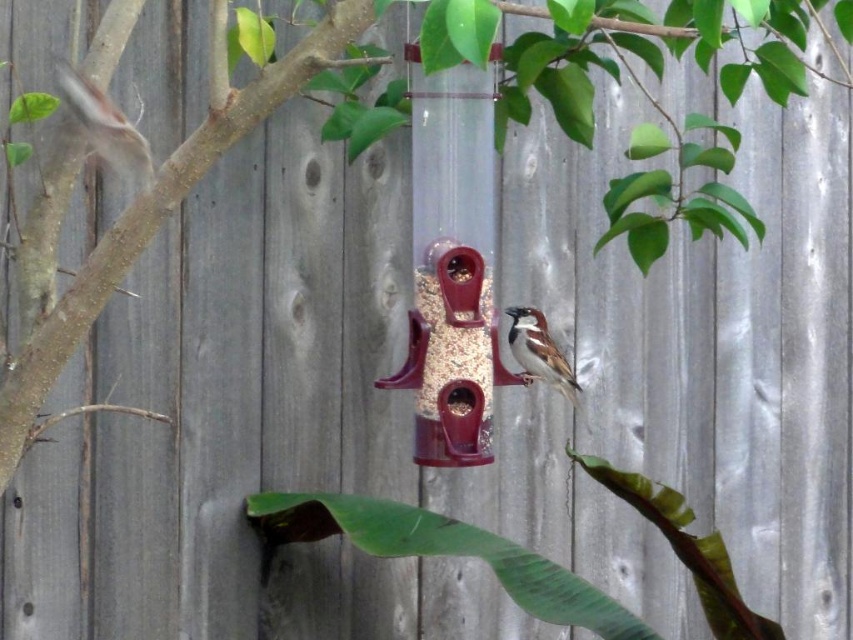
Question: Can you confirm if matte white sparrow at upper left is positioned above brown speckled feathers at center?

Choices:
 (A) yes
 (B) no

Answer: (A)

Question: Which point appears farthest from the camera in this image?

Choices:
 (A) (71, 77)
 (B) (509, 339)

Answer: (B)

Question: Which point is closer to the camera taking this photo?

Choices:
 (A) (532, 376)
 (B) (105, 147)

Answer: (B)

Question: Which point is farther from the camera taking this photo?

Choices:
 (A) (125, 152)
 (B) (552, 374)

Answer: (B)

Question: In this image, where is matte white sparrow at upper left located relative to brown speckled feathers at center?

Choices:
 (A) below
 (B) above

Answer: (B)

Question: Is matte white sparrow at upper left below brown speckled feathers at center?

Choices:
 (A) no
 (B) yes

Answer: (A)